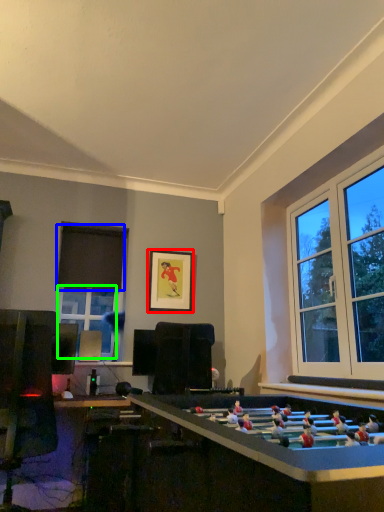
Question: Estimate the real-world distances between objects in this image. Which object is closer to picture frame (highlighted by a red box), curtain (highlighted by a blue box) or window (highlighted by a green box)?

Choices:
 (A) curtain
 (B) window

Answer: (A)